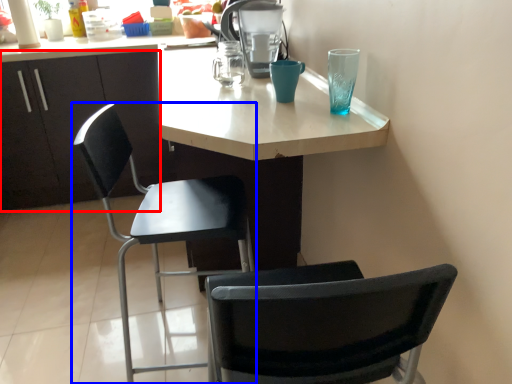
Question: Which object appears farthest to the camera in this image, cabinetry (highlighted by a red box) or chair (highlighted by a blue box)?

Choices:
 (A) cabinetry
 (B) chair

Answer: (A)